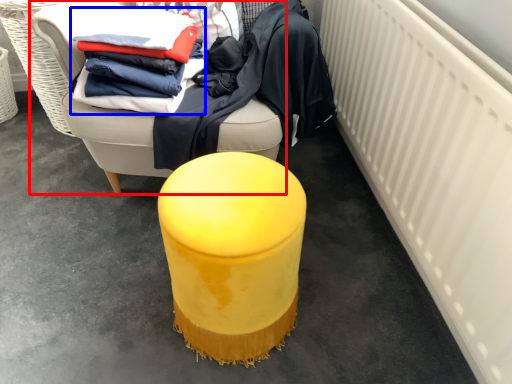
Question: Among these objects, which one is nearest to the camera, furniture (highlighted by a red box) or clothing (highlighted by a blue box)?

Choices:
 (A) furniture
 (B) clothing

Answer: (A)